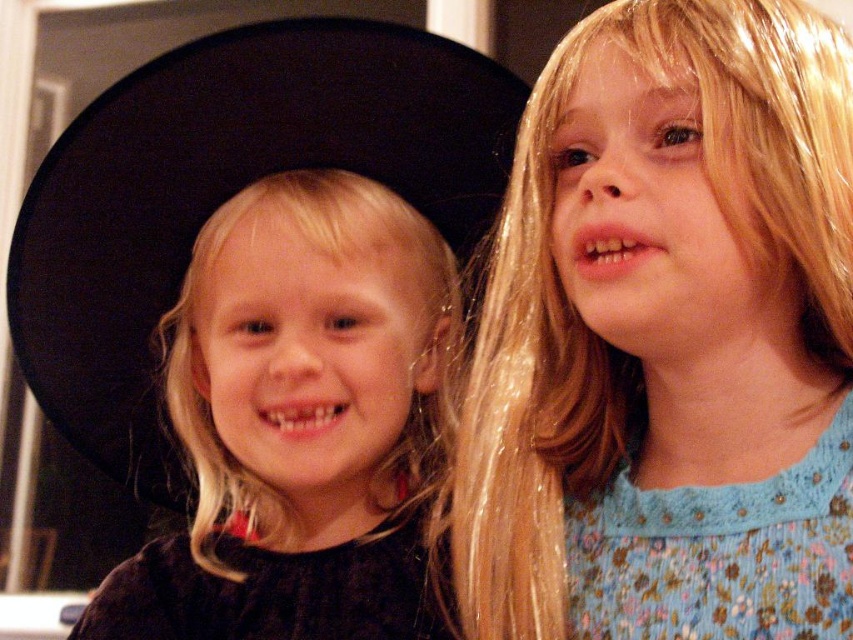
You are a photographer who wants to ensure the black matte dress at center is centered in the frame. Given that the dress is currently at point [302,422], which direction should you move the camera to center it?

The black matte dress at center is already located at point [302,422], so there is no need to move the camera. It is already centered.

You are a photographer setting up for a family portrait. You notice the blue floral dress at upper right and the black velvet dress at lower left in the background. To ensure both dresses are visible in the frame, where should you position the camera?

Position the camera so it can capture both the blue floral dress at upper right and the black velvet dress at lower left by angling it upwards since the blue floral dress at upper right is located above the black velvet dress at lower left.

You are a photographer setting up for a family portrait. You need to position the black matte dress at center and the floral blue fabric dress at right so that they are aligned properly. According to the scene description, which dress should be placed to the left side of the other?

The black matte dress at center should be placed to the left of the floral blue fabric dress at right because the description states that the black matte dress at center is to the left of the floral blue fabric dress at right.